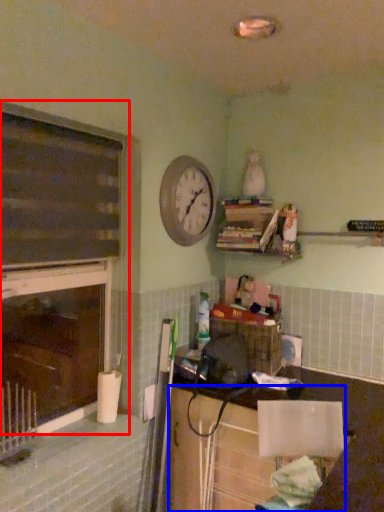
Question: Among these objects, which one is nearest to the camera, window frame (highlighted by a red box) or cabinetry (highlighted by a blue box)?

Choices:
 (A) window frame
 (B) cabinetry

Answer: (A)